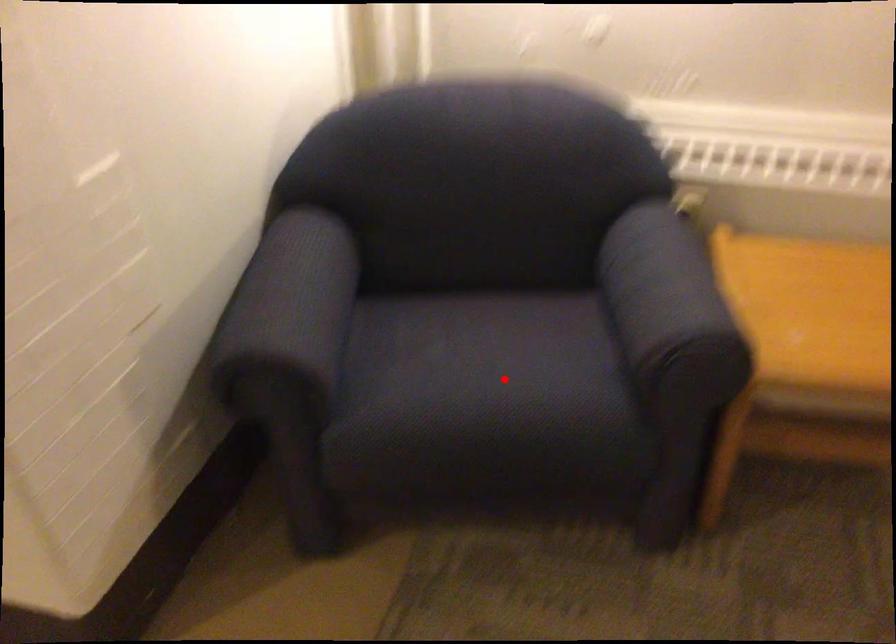
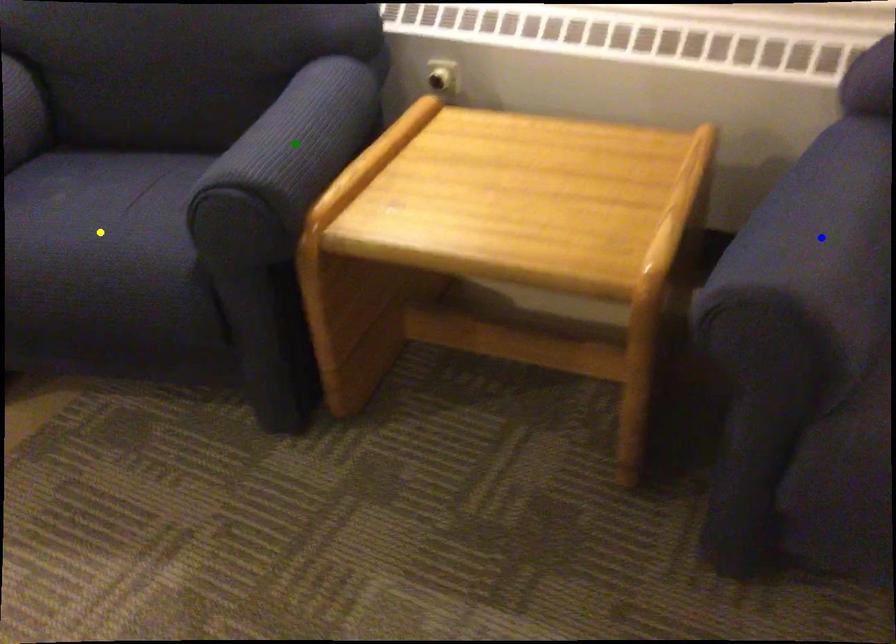
Question: I am providing you with two images of the same scene from different viewpoints. A red point is marked on the first image. You are given multiple points on the second image. Can you choose the point in image 2 that corresponds to the point in image 1?

Choices:
 (A) yellow point
 (B) blue point
 (C) green point

Answer: (A)